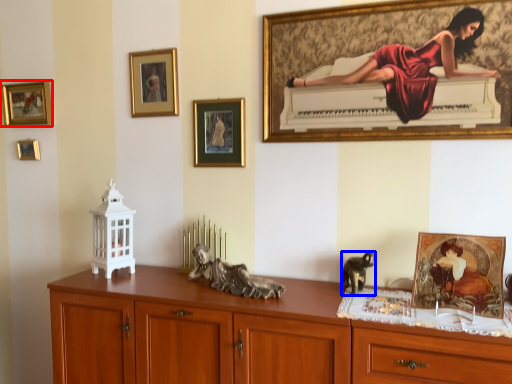
Question: Which of the following is the closest to the observer, picture frame (highlighted by a red box) or animal (highlighted by a blue box)?

Choices:
 (A) picture frame
 (B) animal

Answer: (B)